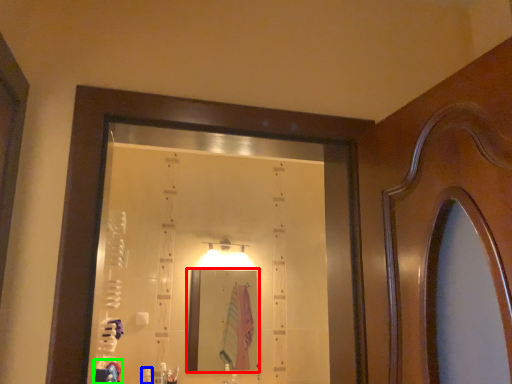
Question: Based on their relative distances, which object is nearer to mirror (highlighted by a red box)? Choose from toiletry (highlighted by a blue box) and robe (highlighted by a green box).

Choices:
 (A) toiletry
 (B) robe

Answer: (A)